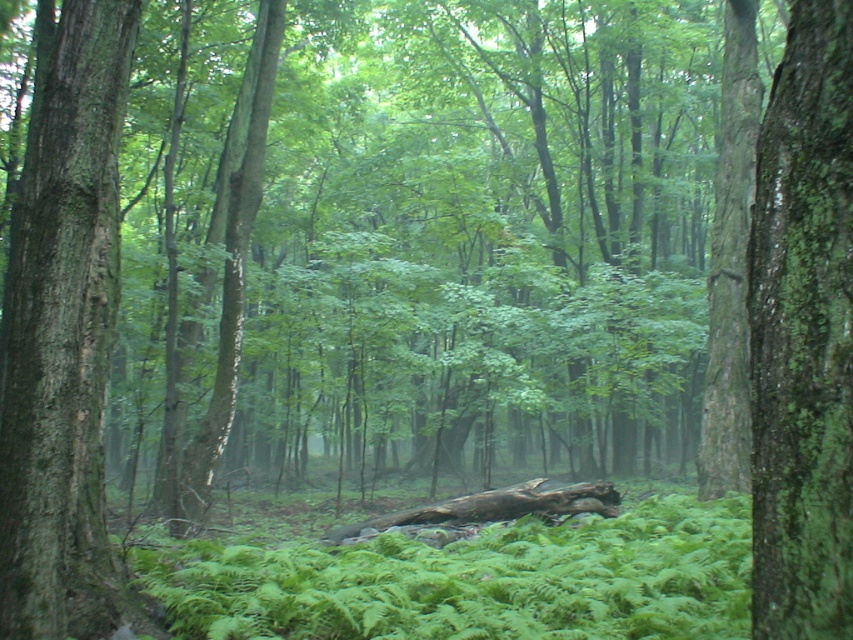
Question: Which object is farther from the camera taking this photo?

Choices:
 (A) green mossy bark tree trunk at right
 (B) brown rough log at center
 (C) smooth bark tree trunk at left

Answer: (B)

Question: Is green mossy bark tree trunk at right thinner than brown rough log at center?

Choices:
 (A) yes
 (B) no

Answer: (A)

Question: Which object is farther from the camera taking this photo?

Choices:
 (A) smooth bark tree trunk at left
 (B) brown rough log at center
 (C) green mossy bark tree trunk at right

Answer: (B)

Question: Is smooth bark tree trunk at left positioned in front of brown rough log at center?

Choices:
 (A) yes
 (B) no

Answer: (A)

Question: Which point is farther to the camera?

Choices:
 (A) (54, 504)
 (B) (328, 540)

Answer: (B)

Question: Where is green mossy bark tree trunk at right located in relation to brown rough log at center in the image?

Choices:
 (A) left
 (B) right

Answer: (B)